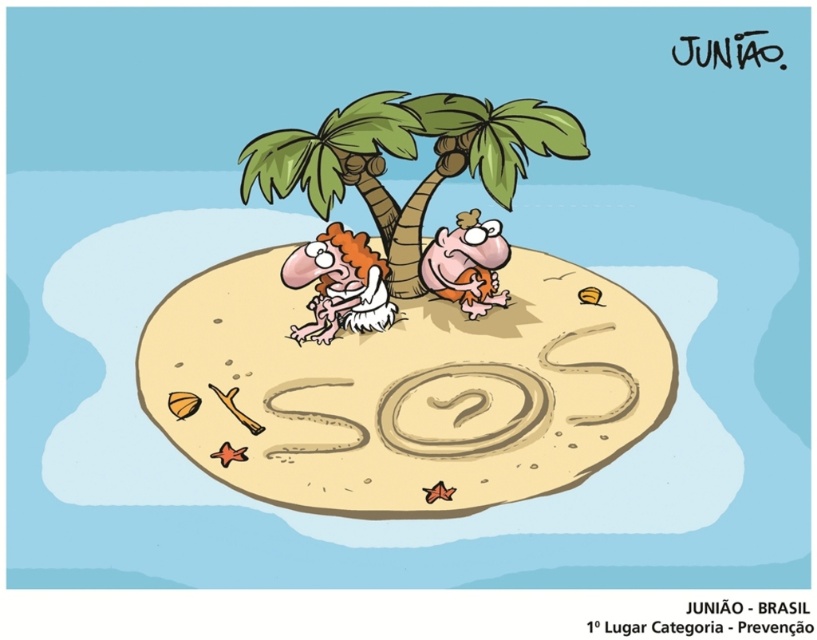
Locate an element on the screen. This screenshot has width=817, height=640. white fur animal at center is located at coordinates (338, 284).

Who is positioned more to the left, white fur animal at center or orange fabric monkey at center?

From the viewer's perspective, white fur animal at center appears more on the left side.

Who is more distant from viewer, (376, 282) or (460, 300)?

The point (460, 300) is more distant.

The height and width of the screenshot is (640, 817). I want to click on white fur animal at center, so click(338, 284).

Which is in front, point (551, 122) or point (356, 282)?

Point (551, 122)

Does point (368, 205) come behind point (289, 259)?

No, (368, 205) is closer to viewer.

At what (x,y) coordinates should I click in order to perform the action: click on green leafy palm tree at upper center. Please return your answer as a coordinate pair (x, y). Looking at the image, I should click on (408, 157).

The width and height of the screenshot is (817, 640). Identify the location of green leafy palm tree at upper center. (408, 157).

Based on the photo, does green leafy palm tree at upper center have a lesser width compared to orange fabric monkey at center?

Incorrect, green leafy palm tree at upper center's width is not less than orange fabric monkey at center's.

Describe the element at coordinates (408, 157) in the screenshot. I see `green leafy palm tree at upper center` at that location.

Find the location of `green leafy palm tree at upper center`. green leafy palm tree at upper center is located at coordinates (408, 157).